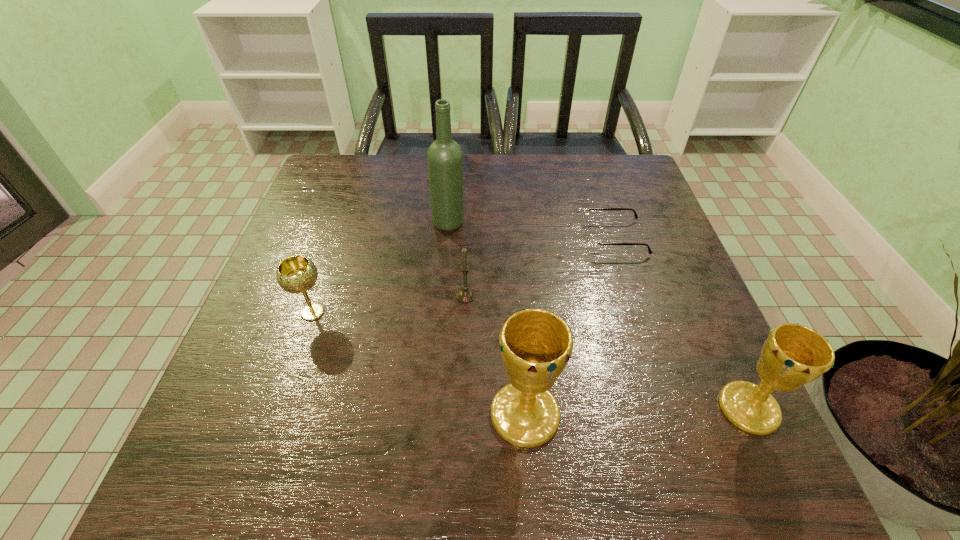
This screenshot has width=960, height=540. Find the location of `vacant region between the second object from right to left and the tallest object`. vacant region between the second object from right to left and the tallest object is located at coordinates (532, 231).

You are a GUI agent. You are given a task and a screenshot of the screen. Output one action in this format:
    pyautogui.click(x=<x>, y=<y>)
    Task: Click on the free space between the rightmost chalice and the third object from right to left
    This screenshot has height=540, width=960.
    Given the screenshot: What is the action you would take?
    pyautogui.click(x=636, y=411)

You are a GUI agent. You are given a task and a screenshot of the screen. Output one action in this format:
    pyautogui.click(x=<x>, y=<y>)
    Task: Click on the free space between the fifth shortest object and the fifth object from left to right
    This screenshot has width=960, height=540.
    Given the screenshot: What is the action you would take?
    pyautogui.click(x=570, y=326)

Find the location of a particular element. This screenshot has width=960, height=540. blank region between the candle and the leftmost chalice is located at coordinates (390, 304).

In order to click on free space between the second tallest chalice and the second chalice from left to right in this screenshot , I will do `click(636, 411)`.

The width and height of the screenshot is (960, 540). Find the location of `empty space that is in between the spectacles and the candle`. empty space that is in between the spectacles and the candle is located at coordinates (540, 267).

Locate an element on the screen. The height and width of the screenshot is (540, 960). the second closest object to the spectacles is located at coordinates (445, 158).

What are the coordinates of `the third closest object to the shortest chalice` in the screenshot? It's located at (536, 344).

The image size is (960, 540). I want to click on chalice object that ranks as the second closest to the wine bottle, so click(536, 344).

This screenshot has width=960, height=540. In order to click on chalice that can be found as the third closest to the fifth object from left to right in this screenshot , I will do `click(296, 274)`.